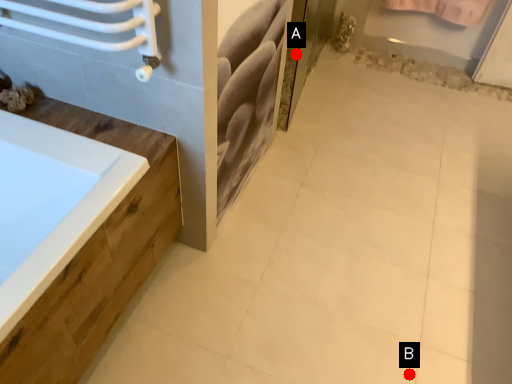
Question: Two points are circled on the image, labeled by A and B beside each circle. Which point is closer to the camera taking this photo?

Choices:
 (A) A is closer
 (B) B is closer

Answer: (B)